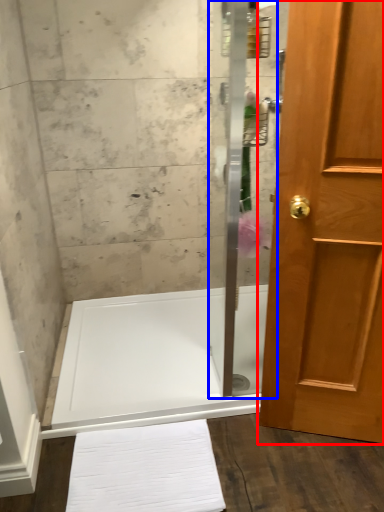
Question: Which of the following is the closest to the observer, door (highlighted by a red box) or shower door (highlighted by a blue box)?

Choices:
 (A) door
 (B) shower door

Answer: (A)